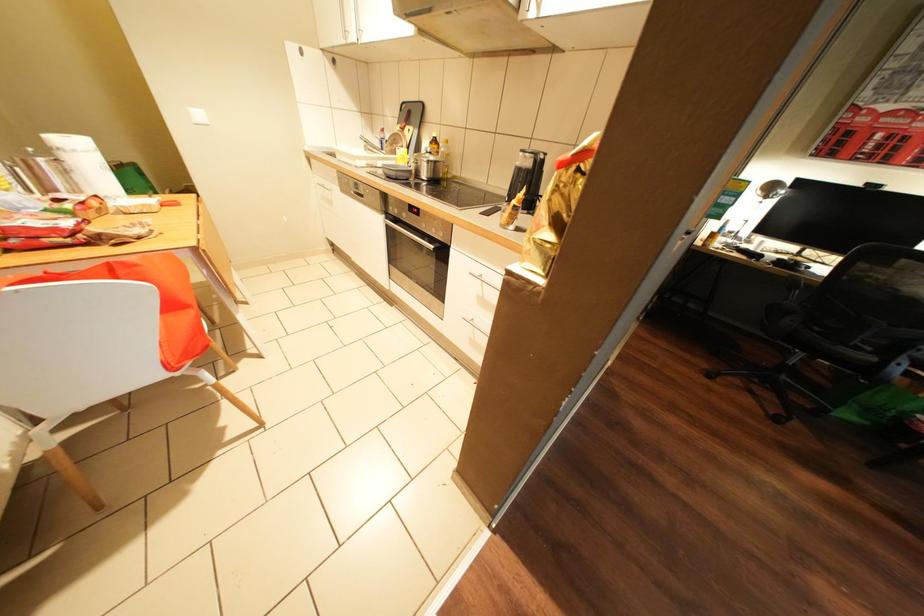
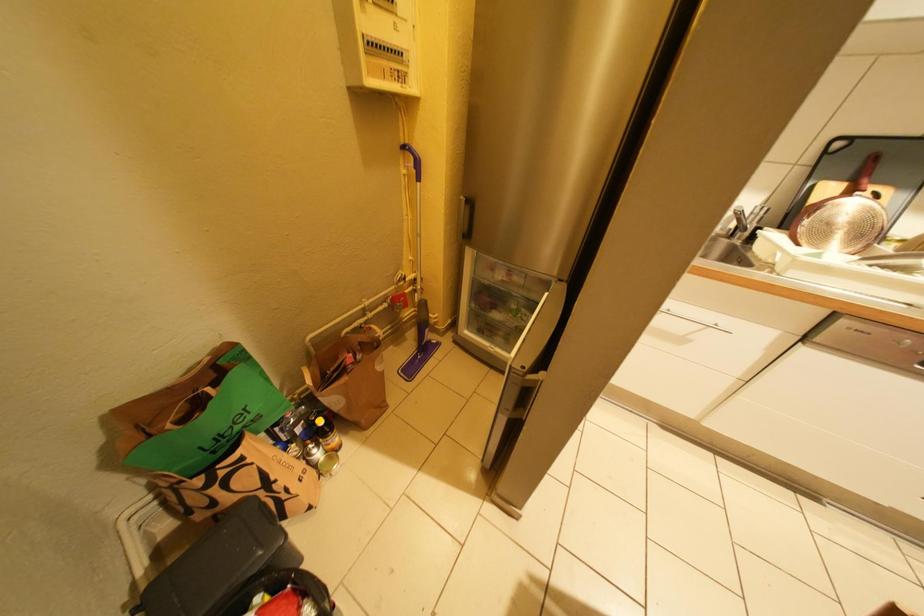
The images are taken continuously from a first-person perspective. In which direction are you moving?

The cameraman walked toward left, forward.